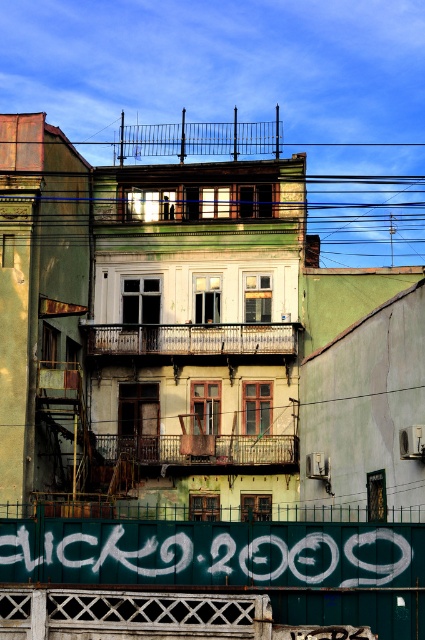
You are standing in front of the residential building and want to take a photo of both the point at coordinates (288,332) and the point at coordinates (220,460). Which point should you focus on first to ensure both are in focus?

You should focus on the point at coordinates (288,332) first because it is closer to the camera than the point at coordinates (220,460). By focusing on the closer point, both points will be in focus due to the depth of field.

You are a painter hired to restore the building. You need to decide whether to start with the white graffiti at center or the rustic wood balcony at center first. Which one is taller and should be addressed first?

The white graffiti at center is much taller than the rustic wood balcony at center, so you should address the white graffiti at center first.